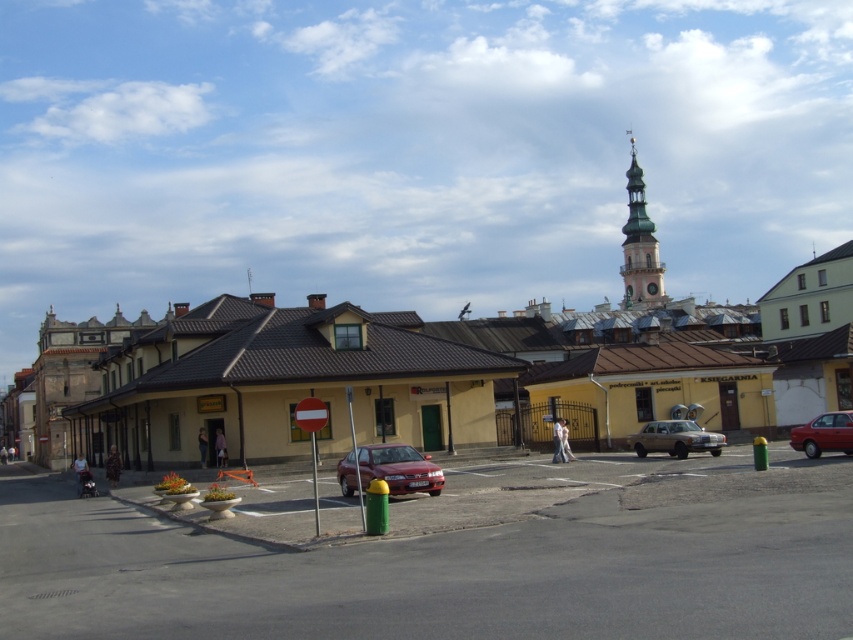
You are standing at the edge of the parking area near the red car and the green bollard. You want to take a photo of the yellow matte building at center. Considering your current position, do you need to move closer or farther away to frame the building properly in your camera?

The yellow matte building at center is 50.77 feet away from the camera. Since you are already at the edge of the parking area near the red car and green bollard, you would need to move closer to the yellow matte building at center to frame it properly in your camera.

You are standing at the center of the street and want to take a photo of the yellow matte building at center. Which direction should you face to ensure the building is in the frame?

The yellow matte building at center is located at point coordinates (303, 364), so you should face towards the center of the street to capture it in your photo.

You are a tourist standing on the street looking at the yellow matte building at center and the green stone clock tower at upper right. Which of these two landmarks is located higher up in the image?

The green stone clock tower at upper right is located higher up in the image than the yellow matte building at center.